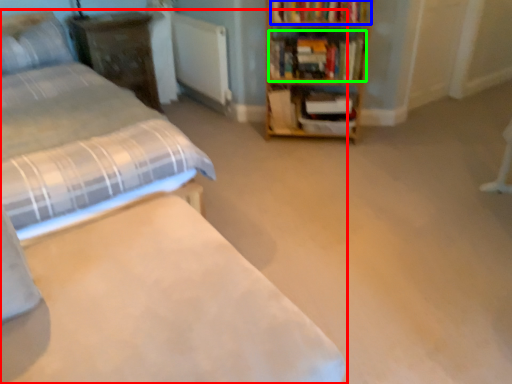
Question: Which object is positioned farthest from bed (highlighted by a red box)? Select from book (highlighted by a blue box) and book (highlighted by a green box).

Choices:
 (A) book
 (B) book

Answer: (A)